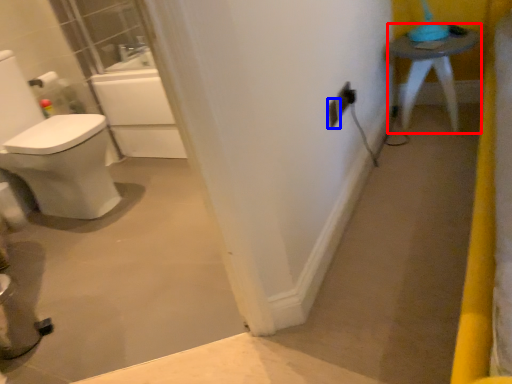
Question: Which of the following is the closest to the observer, furniture (highlighted by a red box) or electric outlet (highlighted by a blue box)?

Choices:
 (A) furniture
 (B) electric outlet

Answer: (B)